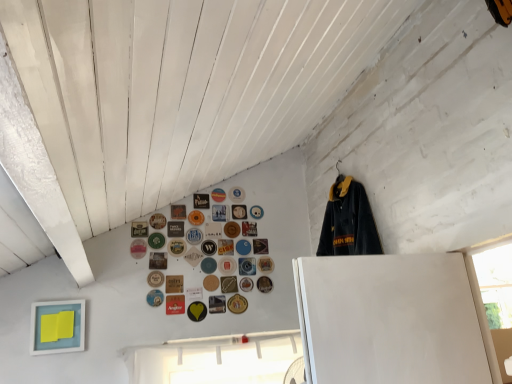
Question: From the image's perspective, is blue fabric button at upper center, positioned as the 13th button in left-to-right order, under metallic gold button at upper center, which is the 13th button in right-to-left order?

Choices:
 (A) no
 (B) yes

Answer: (A)

Question: Is the depth of blue fabric button at upper center, acting as the 25th button starting from the right, less than that of metallic gold button at upper center, which is the 13th button in right-to-left order?

Choices:
 (A) no
 (B) yes

Answer: (B)

Question: Could metallic gold button at upper center, which is the 13th button in right-to-left order, be considered to be inside blue fabric button at upper center, positioned as the 13th button in left-to-right order?

Choices:
 (A) no
 (B) yes

Answer: (A)

Question: From a real-world perspective, is blue fabric button at upper center, acting as the 25th button starting from the right, on top of metallic gold button at upper center, the 25th button in the left-to-right sequence?

Choices:
 (A) yes
 (B) no

Answer: (A)

Question: Is blue fabric button at upper center, positioned as the 13th button in left-to-right order, positioned beyond the bounds of metallic gold button at upper center, the 25th button in the left-to-right sequence?

Choices:
 (A) no
 (B) yes

Answer: (B)

Question: From the image's perspective, is red matte button at lower center, the 26th button positioned from the right, positioned above or below matte brown coaster at upper center, the 29th button viewed from the right?

Choices:
 (A) below
 (B) above

Answer: (A)

Question: Does point pyautogui.click(x=165, y=312) appear closer or farther from the camera than point pyautogui.click(x=175, y=211)?

Choices:
 (A) closer
 (B) farther

Answer: (A)

Question: Looking at the image, does red matte button at lower center, placed as the 12th button when sorted from left to right, seem bigger or smaller compared to matte brown coaster at upper center, the 29th button viewed from the right?

Choices:
 (A) small
 (B) big

Answer: (B)

Question: Based on their positions, is red matte button at lower center, placed as the 12th button when sorted from left to right, located to the left or right of matte brown coaster at upper center, the ninth button viewed from the left?

Choices:
 (A) right
 (B) left

Answer: (A)

Question: Would you say white fabric at lower center is to the left or to the right of matte brown button at upper center, acting as the 30th button starting from the left, in the picture?

Choices:
 (A) left
 (B) right

Answer: (A)

Question: Is point (170, 350) positioned closer to the camera than point (241, 208)?

Choices:
 (A) farther
 (B) closer

Answer: (B)

Question: From the image's perspective, is white fabric at lower center located above or below matte brown button at upper center, acting as the 30th button starting from the left?

Choices:
 (A) above
 (B) below

Answer: (B)

Question: Is white fabric at lower center spatially inside matte brown button at upper center, which is counted as the 8th button, starting from the right, or outside of it?

Choices:
 (A) outside
 (B) inside

Answer: (A)

Question: Is matte plastic button at upper center, the 34th button viewed from the left, in front of or behind green matte button at upper center, which is the 4th button in left-to-right order, in the image?

Choices:
 (A) front
 (B) behind

Answer: (B)

Question: From their relative heights in the image, would you say matte plastic button at upper center, the 34th button viewed from the left, is taller or shorter than green matte button at upper center, acting as the 34th button starting from the right?

Choices:
 (A) tall
 (B) short

Answer: (B)